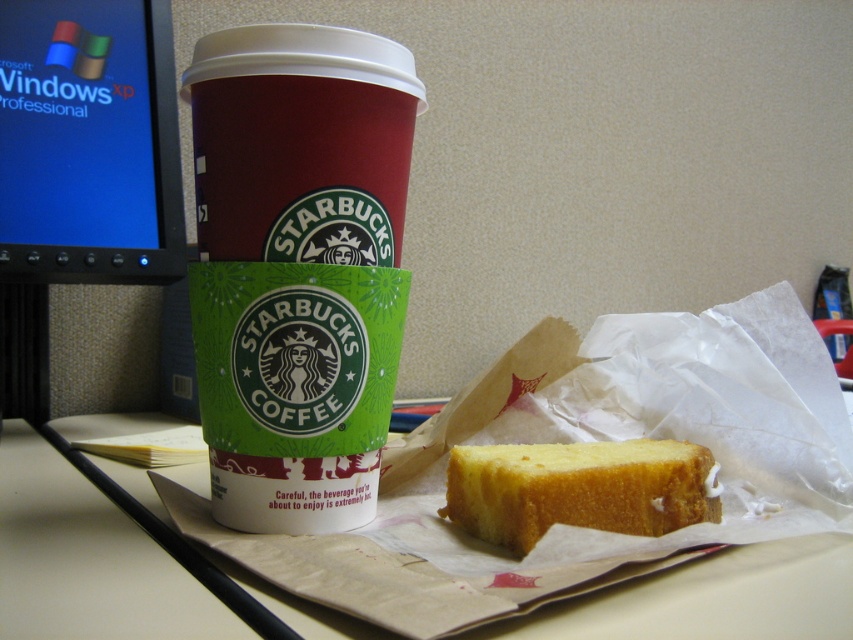
Question: Does matte black monitor at left come behind yellow sponge cake at center?

Choices:
 (A) no
 (B) yes

Answer: (B)

Question: Which of these objects is positioned closest to the matte black monitor at left?

Choices:
 (A) white paper at center
 (B) matte paper cup at left

Answer: (A)

Question: Which point appears farthest from the camera in this image?

Choices:
 (A) tap(47, 630)
 (B) tap(207, 115)
 (C) tap(119, 48)

Answer: (C)

Question: Which point is farther from the camera taking this photo?

Choices:
 (A) (529, 515)
 (B) (88, 44)
 (C) (701, 589)
 (D) (352, 392)

Answer: (B)

Question: Is matte black monitor at left to the right of yellow sponge cake at center from the viewer's perspective?

Choices:
 (A) yes
 (B) no

Answer: (B)

Question: Does matte paper cup at left appear over white paper at center?

Choices:
 (A) yes
 (B) no

Answer: (A)